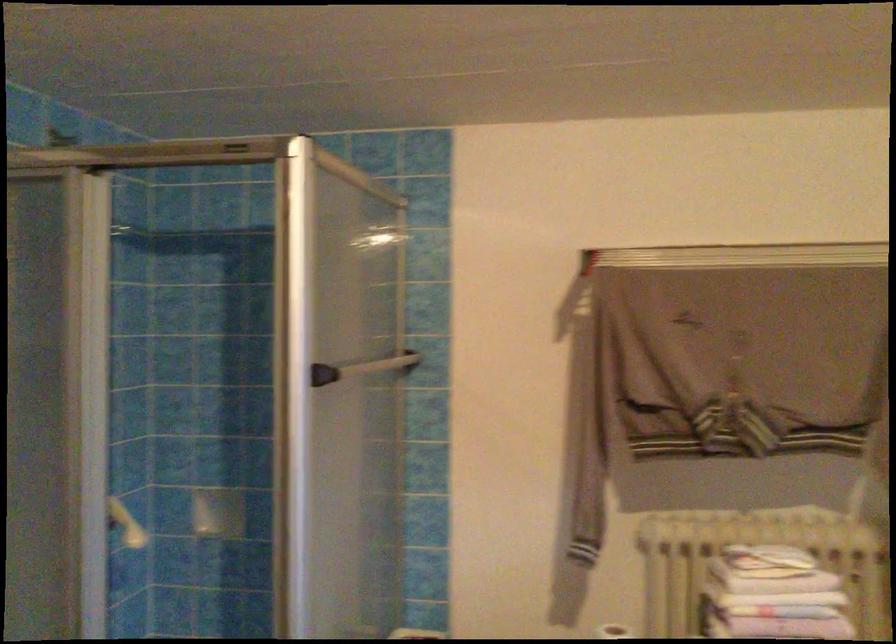
Where is `white grab bar`? white grab bar is located at coordinates (362, 368).